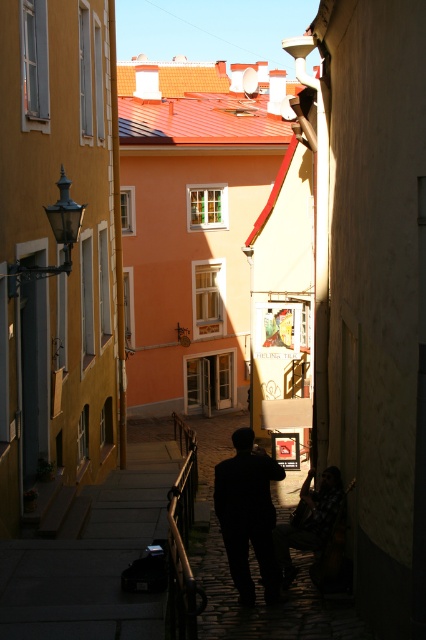
Question: Is silhouette dark clothing at center positioned at the back of dark fabric jacket at center?

Choices:
 (A) yes
 (B) no

Answer: (B)

Question: Does silhouette dark clothing at center appear on the right side of dark fabric jacket at center?

Choices:
 (A) yes
 (B) no

Answer: (B)

Question: Which point is farther to the camera?

Choices:
 (A) (259, 536)
 (B) (317, 548)

Answer: (B)

Question: Can you confirm if silhouette dark clothing at center is positioned below dark fabric jacket at center?

Choices:
 (A) no
 (B) yes

Answer: (B)

Question: Which point is closer to the camera?

Choices:
 (A) silhouette dark clothing at center
 (B) dark fabric jacket at center

Answer: (A)

Question: Which of the following is the farthest from the observer?

Choices:
 (A) silhouette dark clothing at center
 (B) dark fabric jacket at center

Answer: (B)